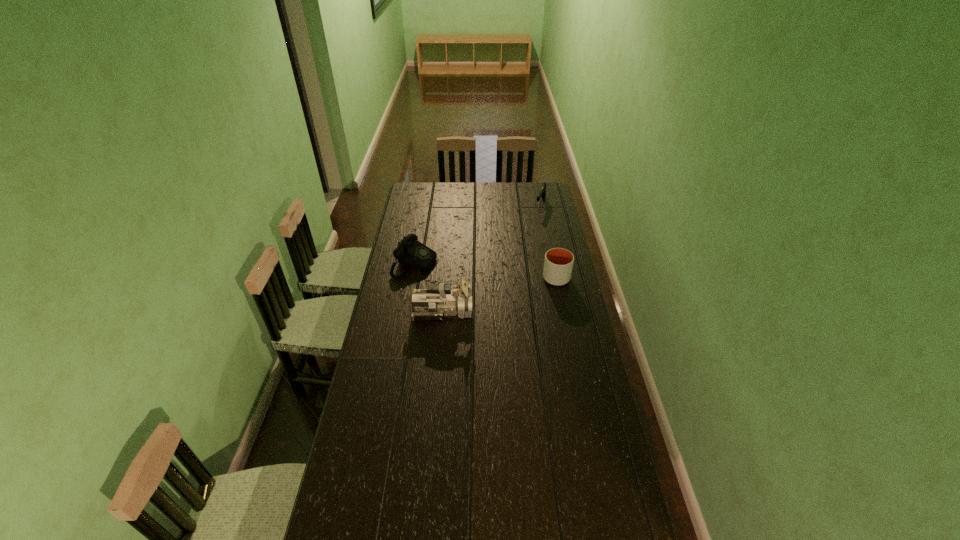
This screenshot has width=960, height=540. In order to click on free spot on the desktop that is between the camcorder and the cup and is positioned at the aiming end of the gun in this screenshot , I will do `click(500, 294)`.

Where is `free spot on the desktop that is between the nearest object and the cup and is positioned on the dial of the telephone`? free spot on the desktop that is between the nearest object and the cup and is positioned on the dial of the telephone is located at coordinates (515, 291).